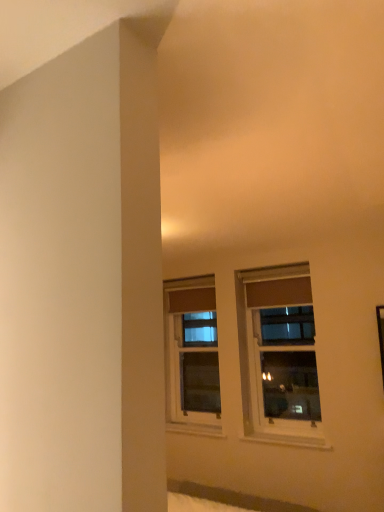
Describe the element at coordinates (192, 356) in the screenshot. I see `matte brown window at center, which is the 2th window from right to left` at that location.

Where is `matte brown window at center, the 2th window positioned from the front`? matte brown window at center, the 2th window positioned from the front is located at coordinates (192, 356).

What is the approximate width of clear glass window at center, placed as the first window when sorted from right to left?

It is 10.81 centimeters.

The image size is (384, 512). What do you see at coordinates (288, 362) in the screenshot? I see `clear glass window at center, marked as the second window in a left-to-right arrangement` at bounding box center [288, 362].

Measure the distance between point [299,330] and camera.

Point [299,330] and camera are 3.65 meters apart from each other.

Identify the location of clear glass window at center, arranged as the first window when viewed from the front. Image resolution: width=384 pixels, height=512 pixels. (288, 362).

Measure the distance between clear glass window at center, placed as the first window when sorted from right to left, and camera.

A distance of 3.25 meters exists between clear glass window at center, placed as the first window when sorted from right to left, and camera.

I want to click on matte brown window at center, which is the first window from back to front, so click(x=192, y=356).

Visually, is clear glass window at center, marked as the second window in a left-to-right arrangement, positioned to the left or to the right of matte brown window at center, which is the 2th window from right to left?

In the image, clear glass window at center, marked as the second window in a left-to-right arrangement, appears on the right side of matte brown window at center, which is the 2th window from right to left.

Which is behind, clear glass window at center, placed as the first window when sorted from right to left, or matte brown window at center, marked as the first window in a left-to-right arrangement?

matte brown window at center, marked as the first window in a left-to-right arrangement, is further away from the camera.

Considering the points (300, 362) and (208, 318), which point is in front, point (300, 362) or point (208, 318)?

The point (300, 362) is closer.

From the image's perspective, which is above, clear glass window at center, placed as the first window when sorted from right to left, or matte brown window at center, which is the first window from back to front?

clear glass window at center, placed as the first window when sorted from right to left, from the image's perspective.

From a real-world perspective, who is located lower, clear glass window at center, arranged as the first window when viewed from the front, or matte brown window at center, which is the first window from back to front?

clear glass window at center, arranged as the first window when viewed from the front, is physically lower.

Considering the relative sizes of clear glass window at center, arranged as the first window when viewed from the front, and matte brown window at center, marked as the first window in a left-to-right arrangement, in the image provided, is clear glass window at center, arranged as the first window when viewed from the front, wider than matte brown window at center, marked as the first window in a left-to-right arrangement,?

No.

In terms of height, does clear glass window at center, arranged as the first window when viewed from the front, look taller or shorter compared to matte brown window at center, which is the first window from back to front?

Clearly, clear glass window at center, arranged as the first window when viewed from the front, is taller compared to matte brown window at center, which is the first window from back to front.

Considering the sizes of objects clear glass window at center, marked as the second window in a left-to-right arrangement, and matte brown window at center, marked as the first window in a left-to-right arrangement, in the image provided, who is bigger, clear glass window at center, marked as the second window in a left-to-right arrangement, or matte brown window at center, marked as the first window in a left-to-right arrangement,?

matte brown window at center, marked as the first window in a left-to-right arrangement, is bigger.

Is matte brown window at center, the 2th window positioned from the front, completely or partially inside clear glass window at center, which appears as the second window when viewed from the back?

Definitely not — matte brown window at center, the 2th window positioned from the front, is not inside clear glass window at center, which appears as the second window when viewed from the back.

Is there a large distance between clear glass window at center, arranged as the first window when viewed from the front, and matte brown window at center, which is the 2th window from right to left?

That's not correct — clear glass window at center, arranged as the first window when viewed from the front, is a little close to matte brown window at center, which is the 2th window from right to left.

Is clear glass window at center, marked as the second window in a left-to-right arrangement, facing away from matte brown window at center, which is the 2th window from right to left?

No, clear glass window at center, marked as the second window in a left-to-right arrangement, is not facing the opposite direction of matte brown window at center, which is the 2th window from right to left.

What's the angular difference between clear glass window at center, which appears as the second window when viewed from the back, and matte brown window at center, the 2th window positioned from the front,'s facing directions?

The facing directions of clear glass window at center, which appears as the second window when viewed from the back, and matte brown window at center, the 2th window positioned from the front, are 0.00178 degrees apart.

This screenshot has height=512, width=384. Identify the location of window behind the clear glass window at center, placed as the first window when sorted from right to left. (192, 356).

Looking at this image, considering the positions of objects matte brown window at center, marked as the first window in a left-to-right arrangement, and clear glass window at center, which appears as the second window when viewed from the back, in the image provided, who is more to the left, matte brown window at center, marked as the first window in a left-to-right arrangement, or clear glass window at center, which appears as the second window when viewed from the back,?

matte brown window at center, marked as the first window in a left-to-right arrangement.

Relative to clear glass window at center, placed as the first window when sorted from right to left, is matte brown window at center, the 2th window positioned from the front, in front or behind?

matte brown window at center, the 2th window positioned from the front, is positioned farther from the viewer than clear glass window at center, placed as the first window when sorted from right to left.

Between point (212, 405) and point (299, 404), which one is positioned behind?

The point (212, 405) is farther.

From the image's perspective, which is below, matte brown window at center, marked as the first window in a left-to-right arrangement, or clear glass window at center, arranged as the first window when viewed from the front?

matte brown window at center, marked as the first window in a left-to-right arrangement, from the image's perspective.

Looking at this image, from a real-world perspective, which is physically above, matte brown window at center, marked as the first window in a left-to-right arrangement, or clear glass window at center, arranged as the first window when viewed from the front?

In real-world perspective, matte brown window at center, marked as the first window in a left-to-right arrangement, is above.

Considering the sizes of matte brown window at center, marked as the first window in a left-to-right arrangement, and clear glass window at center, which appears as the second window when viewed from the back, in the image, is matte brown window at center, marked as the first window in a left-to-right arrangement, wider or thinner than clear glass window at center, which appears as the second window when viewed from the back,?

Clearly, matte brown window at center, marked as the first window in a left-to-right arrangement, has more width compared to clear glass window at center, which appears as the second window when viewed from the back.

Does matte brown window at center, which is the 2th window from right to left, have a greater height compared to clear glass window at center, marked as the second window in a left-to-right arrangement?

In fact, matte brown window at center, which is the 2th window from right to left, may be shorter than clear glass window at center, marked as the second window in a left-to-right arrangement.

Considering the sizes of objects matte brown window at center, which is the 2th window from right to left, and clear glass window at center, marked as the second window in a left-to-right arrangement, in the image provided, who is smaller, matte brown window at center, which is the 2th window from right to left, or clear glass window at center, marked as the second window in a left-to-right arrangement,?

clear glass window at center, marked as the second window in a left-to-right arrangement.

Is matte brown window at center, which is the 2th window from right to left, completely or partially outside of clear glass window at center, which appears as the second window when viewed from the back?

Yes, matte brown window at center, which is the 2th window from right to left, is located beyond the bounds of clear glass window at center, which appears as the second window when viewed from the back.

Is matte brown window at center, which is the first window from back to front, next to clear glass window at center, which appears as the second window when viewed from the back, and touching it?

matte brown window at center, which is the first window from back to front, is not next to clear glass window at center, which appears as the second window when viewed from the back, and they're not touching.

Is matte brown window at center, marked as the first window in a left-to-right arrangement, aimed at clear glass window at center, which appears as the second window when viewed from the back?

No.

Identify the location of window behind the clear glass window at center, which appears as the second window when viewed from the back. This screenshot has height=512, width=384. (192, 356).

This screenshot has height=512, width=384. I want to click on window that appears above the clear glass window at center, which appears as the second window when viewed from the back (from a real-world perspective), so click(192, 356).

You are a GUI agent. You are given a task and a screenshot of the screen. Output one action in this format:
    pyautogui.click(x=<x>, y=<y>)
    Task: Click on the window behind the clear glass window at center, arranged as the first window when viewed from the front
    The width and height of the screenshot is (384, 512).
    Given the screenshot: What is the action you would take?
    pyautogui.click(x=192, y=356)